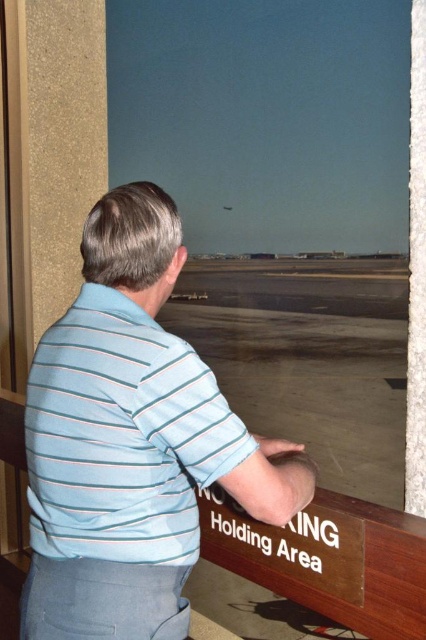
You are an airport security officer inspecting the scene. You notice the light blue striped polo shirt at center and the smooth concrete tarmac at center. Which object is shorter in height?

The light blue striped polo shirt at center is not as tall as the smooth concrete tarmac at center, so the light blue striped polo shirt at center is shorter in height.

You are an airport security officer checking the dimensions of clothing items. You see a light blue striped shirt at center and a smooth concrete tarmac at center. Which item is narrower?

The light blue striped shirt at center is narrower than the smooth concrete tarmac at center.

You are a drone operator who needs to fly a drone to a specific point in the scene. The point you need to reach is point (224, 467). Given that the drone can only travel 35 inches, will it be able to reach the point?

The distance between point (224, 467) and the camera is 37.20 inches, which is beyond the drone operator can travel with a 35 inches limit. The drone will not be able to reach the point.